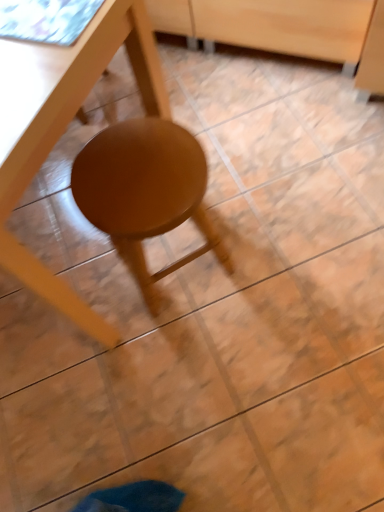
Find the location of a particular element. free point above matte wood stool at center (from a real-world perspective) is located at coordinates (135, 176).